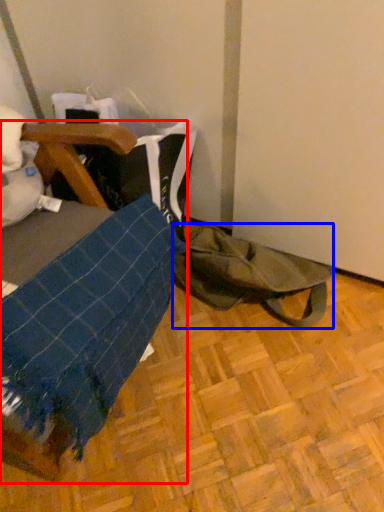
Question: Which object appears closest to the camera in this image, furniture (highlighted by a red box) or tote bag (highlighted by a blue box)?

Choices:
 (A) furniture
 (B) tote bag

Answer: (A)